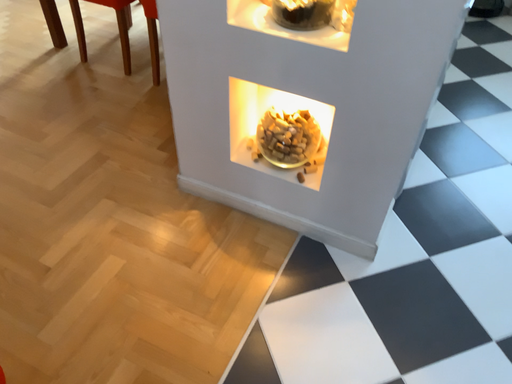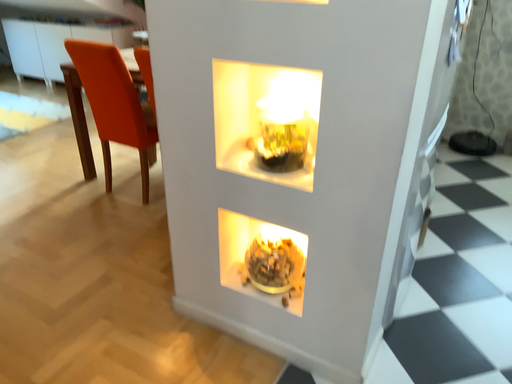
Question: Which way did the camera rotate in the video?

Choices:
 (A) rotated upward
 (B) rotated downward

Answer: (A)